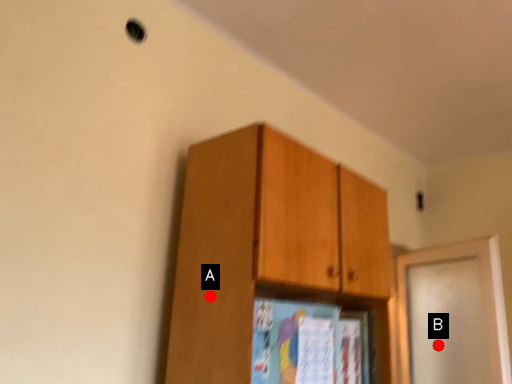
Question: Two points are circled on the image, labeled by A and B beside each circle. Which point is closer to the camera taking this photo?

Choices:
 (A) A is closer
 (B) B is closer

Answer: (A)